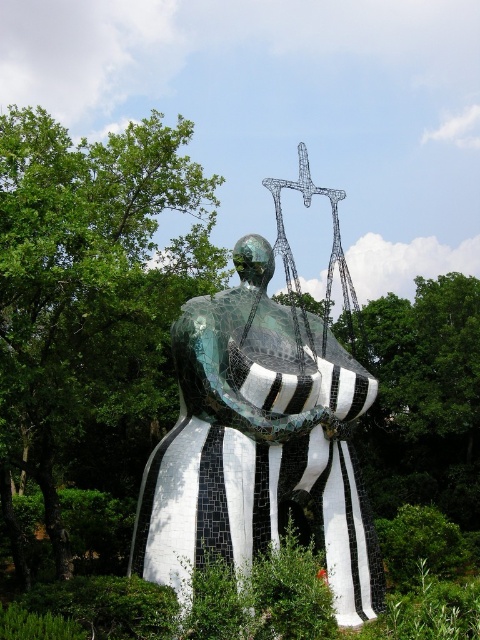
You are an art student analyzing the sculpture arrangement in the image. You observe the black and white mosaic statue at center and the metallic wire sculpture at upper center. Which of these two objects is located more to the right side of the image?

The metallic wire sculpture at upper center is more to the right side of the image because the black and white mosaic statue at center is positioned on its left side.

You are standing at the entrance of the sculpture garden and want to take a photo of the black and white mosaic statue at center. According to the coordinates provided, where should you position yourself to ensure the statue is in the frame?

The black and white mosaic statue at center is located at point (259,442), so you should position yourself facing that coordinate to capture it in your photo.